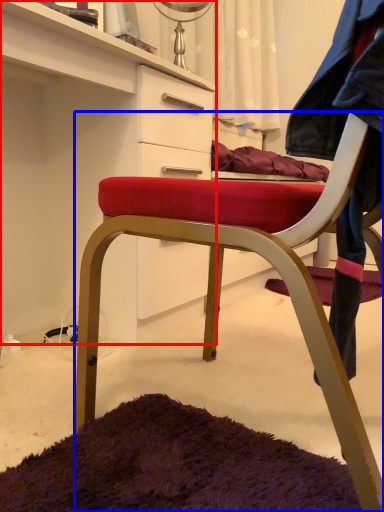
Question: Which object appears closest to the camera in this image, cabinetry (highlighted by a red box) or chair (highlighted by a blue box)?

Choices:
 (A) cabinetry
 (B) chair

Answer: (B)